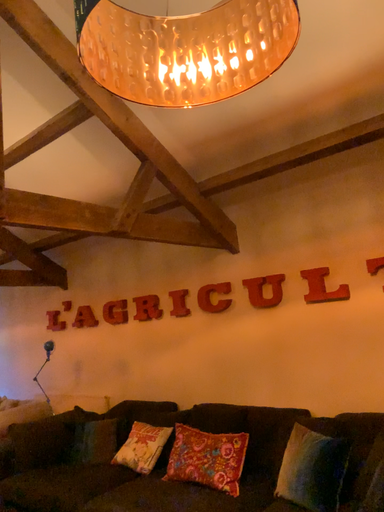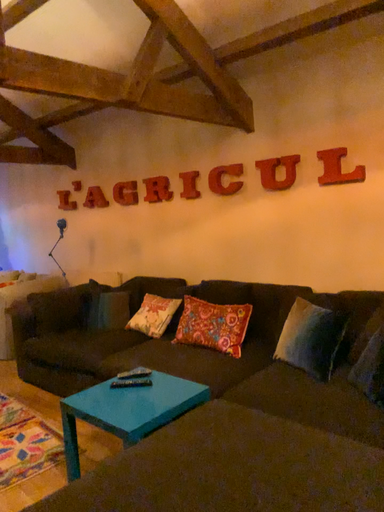
Question: How did the camera likely rotate when shooting the video?

Choices:
 (A) rotated downward
 (B) rotated upward

Answer: (A)